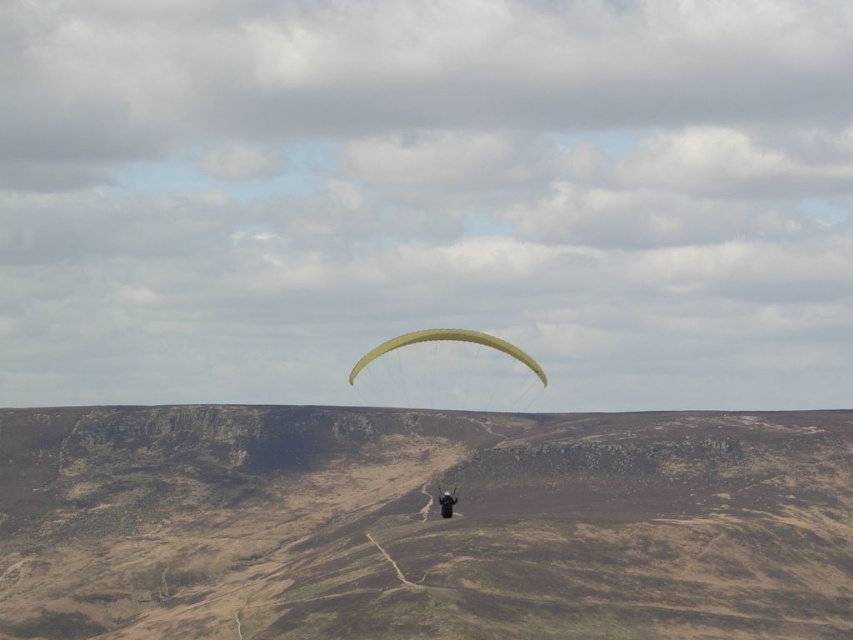
Question: Considering the relative positions of yellow fabric parachute at center and black fabric person at center in the image provided, where is yellow fabric parachute at center located with respect to black fabric person at center?

Choices:
 (A) above
 (B) below

Answer: (A)

Question: Which object is the farthest from the yellow fabric parachute at center?

Choices:
 (A) brown textured hillside at center
 (B) black fabric person at center

Answer: (B)

Question: Based on their relative distances, which object is nearer to the black fabric person at center?

Choices:
 (A) brown textured hillside at center
 (B) yellow fabric parachute at center

Answer: (B)

Question: Estimate the real-world distances between objects in this image. Which object is closer to the black fabric person at center?

Choices:
 (A) brown textured hillside at center
 (B) yellow fabric parachute at center

Answer: (B)

Question: Is brown textured hillside at center above black fabric person at center?

Choices:
 (A) no
 (B) yes

Answer: (A)

Question: From the image, what is the correct spatial relationship of brown textured hillside at center in relation to yellow fabric parachute at center?

Choices:
 (A) right
 (B) left

Answer: (A)